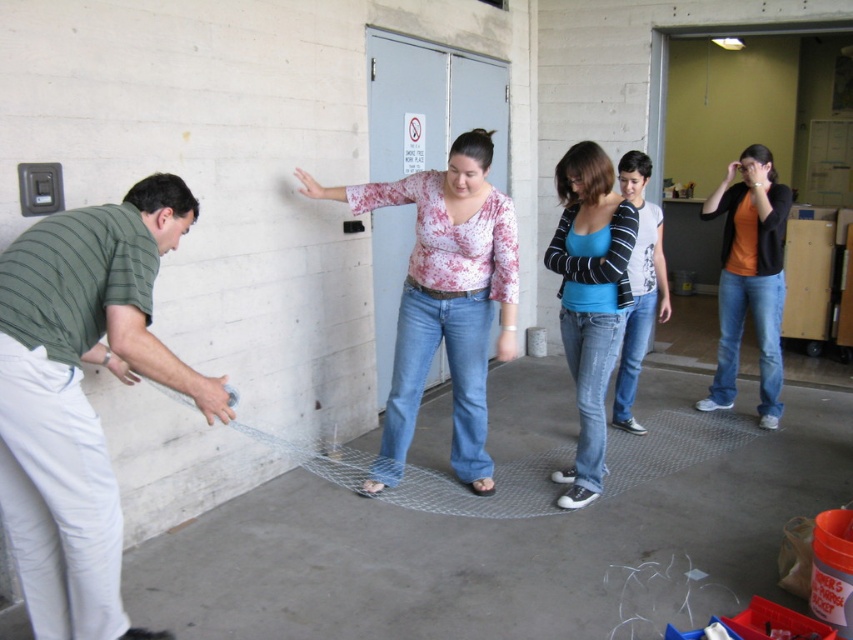
Question: Among these points, which one is farthest from the camera?

Choices:
 (A) (403, 428)
 (B) (770, 300)
 (C) (132, 230)

Answer: (B)

Question: Among these points, which one is nearest to the camera?

Choices:
 (A) (103, 460)
 (B) (430, 356)
 (C) (727, 301)
 (D) (573, 486)

Answer: (A)

Question: Is green striped shirt at left smaller than orange matte shirt at right?

Choices:
 (A) no
 (B) yes

Answer: (B)

Question: Which object appears closest to the camera in this image?

Choices:
 (A) green striped shirt at left
 (B) blue cotton shirt at center

Answer: (A)

Question: Is green striped shirt at left below blue cotton shirt at center?

Choices:
 (A) yes
 (B) no

Answer: (A)

Question: Can you confirm if blue cotton shirt at center is bigger than orange matte shirt at right?

Choices:
 (A) no
 (B) yes

Answer: (A)